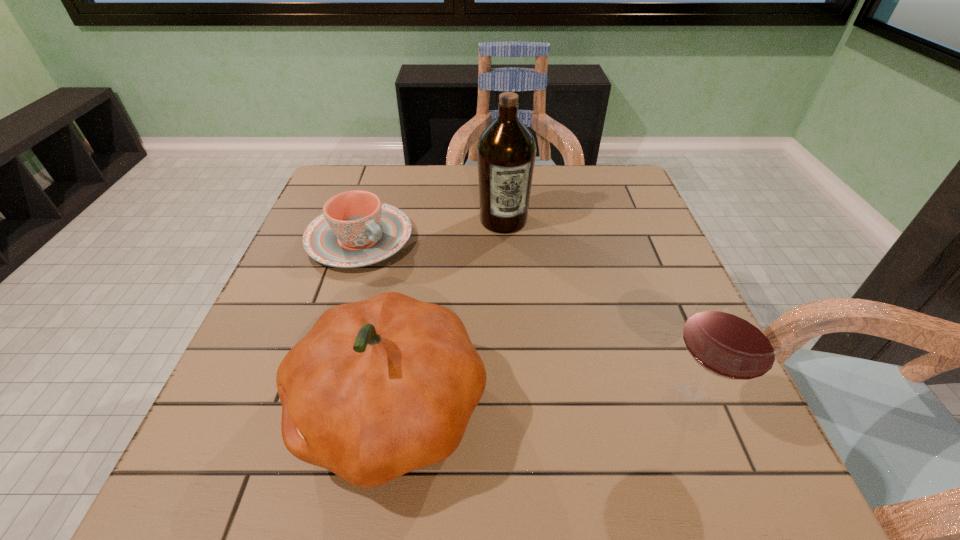
The width and height of the screenshot is (960, 540). In order to click on object at the near right corner in this screenshot , I will do `click(731, 335)`.

Find the location of a particular element. blank space at the far edge of the desktop is located at coordinates (570, 188).

Identify the location of vacant space at the left edge of the desktop. The image size is (960, 540). (297, 289).

In the image, there is a desktop. Where is `vacant space at the right edge`? The height and width of the screenshot is (540, 960). vacant space at the right edge is located at coordinates (648, 237).

You are a GUI agent. You are given a task and a screenshot of the screen. Output one action in this format:
    pyautogui.click(x=<x>, y=<y>)
    Task: Click on the blank space at the far left corner
    This screenshot has height=540, width=960.
    Given the screenshot: What is the action you would take?
    pyautogui.click(x=359, y=176)

This screenshot has height=540, width=960. Identify the location of vacant area at the near left corner. (233, 388).

Identify the location of free area in between the shortest object and the wineglass. (525, 323).

This screenshot has width=960, height=540. I want to click on free space between the tallest object and the rightmost object, so click(x=597, y=314).

The height and width of the screenshot is (540, 960). Identify the location of free space between the pumpkin and the rightmost object. (540, 408).

The height and width of the screenshot is (540, 960). What are the coordinates of `vacant area that lies between the tallest object and the chinaware` in the screenshot? It's located at (432, 230).